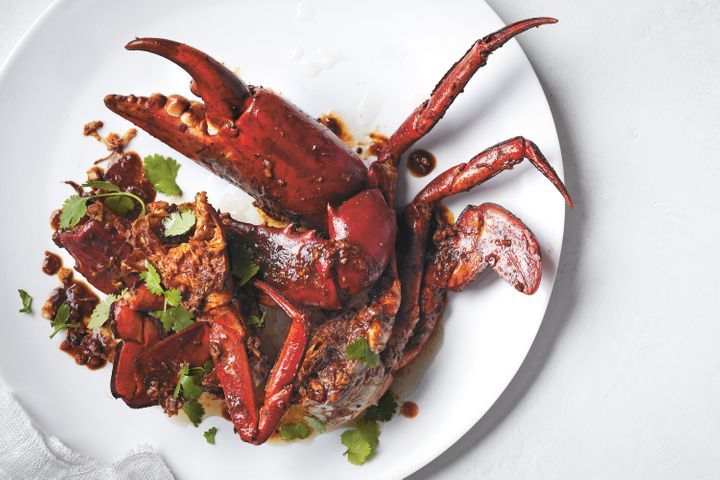
I want to click on plate, so click(306, 70).